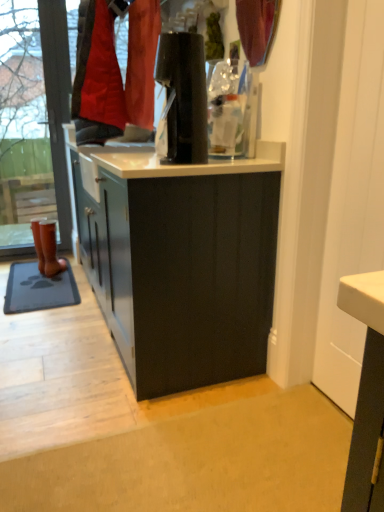
Identify the location of blank space to the left of brown leather boot at left. (30, 270).